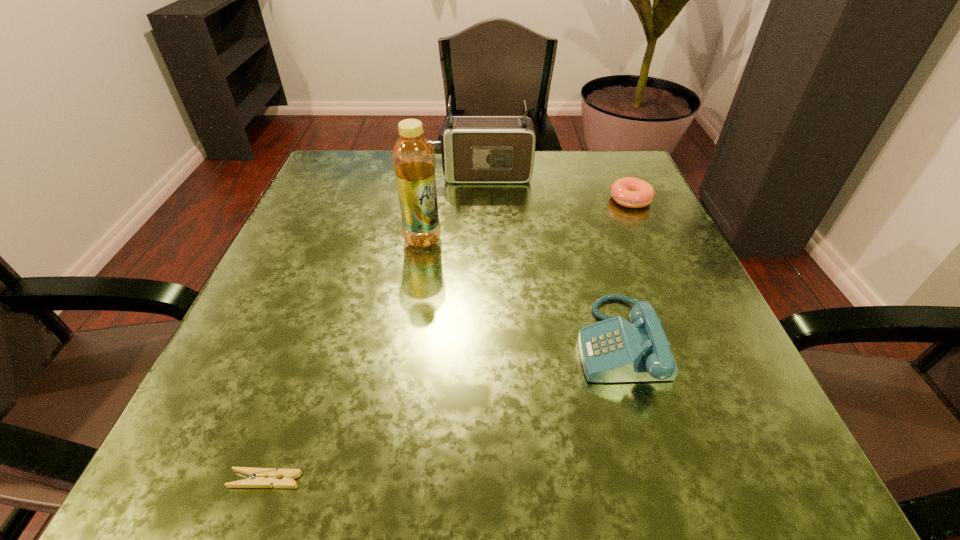
You are a GUI agent. You are given a task and a screenshot of the screen. Output one action in this format:
    pyautogui.click(x=<x>, y=<y>)
    Task: Click on the doughnut at the far edge
    The image size is (960, 540).
    Given the screenshot: What is the action you would take?
    pyautogui.click(x=630, y=192)

Where is `object at the near edge`? object at the near edge is located at coordinates (258, 477).

Locate an element on the screen. The width and height of the screenshot is (960, 540). object at the left edge is located at coordinates (258, 477).

Find the location of a particular element. Image resolution: width=960 pixels, height=540 pixels. telephone that is at the right edge is located at coordinates (614, 350).

The image size is (960, 540). Find the location of `doughnut that is at the right edge`. doughnut that is at the right edge is located at coordinates (630, 192).

At what (x,y) coordinates should I click in order to perform the action: click on object that is at the near left corner. Please return your answer as a coordinate pair (x, y). The width and height of the screenshot is (960, 540). Looking at the image, I should click on (258, 477).

Find the location of a particular element. The height and width of the screenshot is (540, 960). object present at the far right corner is located at coordinates (630, 192).

Where is `vacant region at the far edge of the desktop`? vacant region at the far edge of the desktop is located at coordinates (563, 202).

Find the location of a particular element. The image size is (960, 540). vacant region at the near edge is located at coordinates (556, 475).

Where is `blank space at the left edge`? Image resolution: width=960 pixels, height=540 pixels. blank space at the left edge is located at coordinates (224, 408).